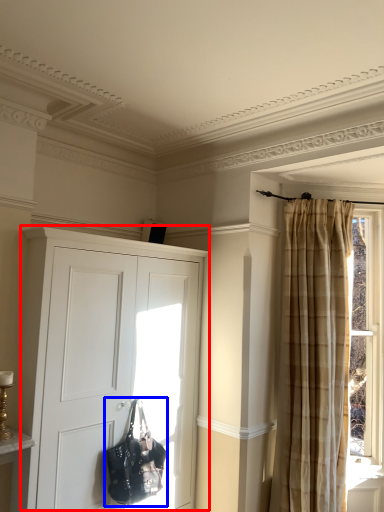
Question: Among these objects, which one is farthest to the camera, cupboard (highlighted by a red box) or handbag (highlighted by a blue box)?

Choices:
 (A) cupboard
 (B) handbag

Answer: (B)